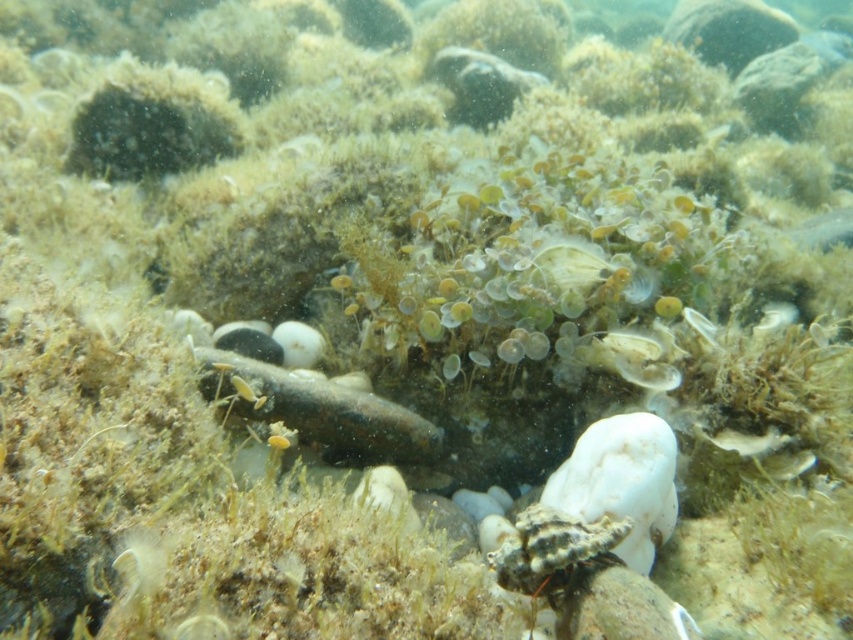
Question: Does speckled brown fish at center have a greater width compared to translucent glass fish at lower right?

Choices:
 (A) no
 (B) yes

Answer: (B)

Question: Among these points, which one is farthest from the camera?

Choices:
 (A) (608, 532)
 (B) (247, 403)

Answer: (B)

Question: Which point is farther to the camera?

Choices:
 (A) speckled brown shell at center
 (B) translucent glass fish at lower right

Answer: (B)

Question: Does speckled brown shell at center appear over translucent glass fish at lower right?

Choices:
 (A) no
 (B) yes

Answer: (A)

Question: Can you confirm if speckled brown fish at center is wider than translucent glass fish at lower right?

Choices:
 (A) yes
 (B) no

Answer: (A)

Question: Which of the following is the closest to the observer?

Choices:
 (A) (541, 595)
 (B) (231, 385)
 (C) (730, 440)

Answer: (A)